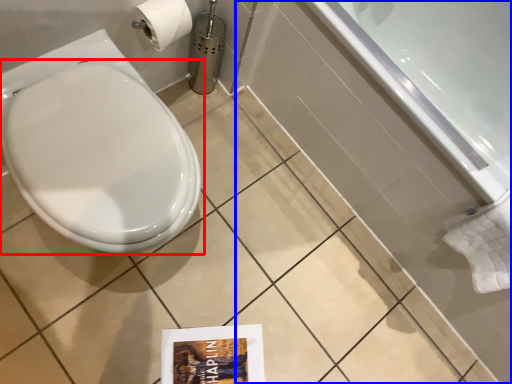
Question: Which object is closer to the camera taking this photo, toilet (highlighted by a red box) or bath (highlighted by a blue box)?

Choices:
 (A) toilet
 (B) bath

Answer: (A)